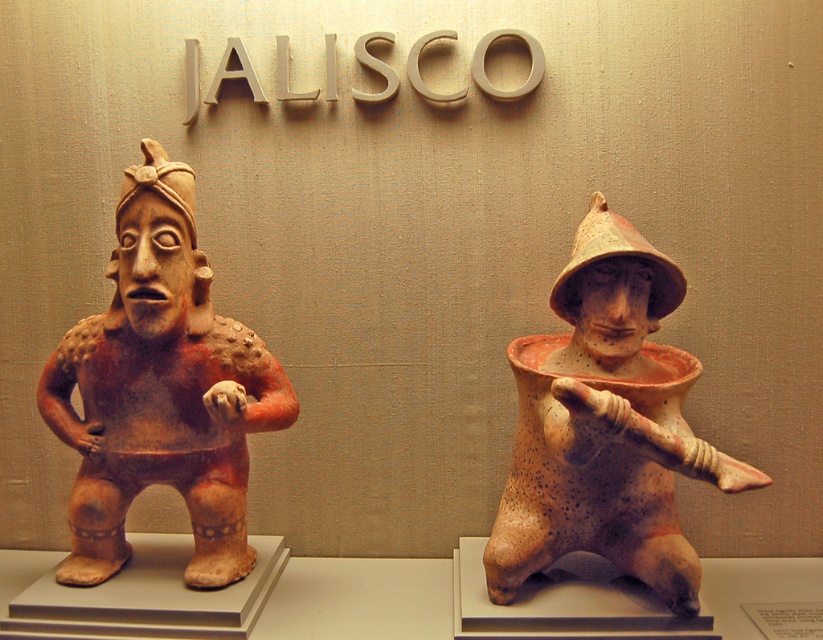
You are a museum curator arranging an exhibition. You have two figurines to display on a shelf. The matte orange clay figure at left and the speckled clay figure at center. Based on their sizes, which figurine should be placed first if you want to follow the size descending order from left to right?

The matte orange clay figure at left is larger than the speckled clay figure at center, so to follow the size descending order from left to right, you should place the matte orange clay figure at left first on the left side of the shelf, followed by the speckled clay figure at center on the right side.

You are a museum curator planning to move the two figures closer for an exhibition. The new display case allows a minimum of 15 inches between items for visitor accessibility. Can the matte orange clay figure at left and the speckled clay figure at center be placed closer together without violating the minimum distance requirement?

The current distance between the matte orange clay figure at left and the speckled clay figure at center is 18.22 inches. Since the minimum required distance is 15 inches, they can be moved closer but must not be placed closer than 15 inches apart.